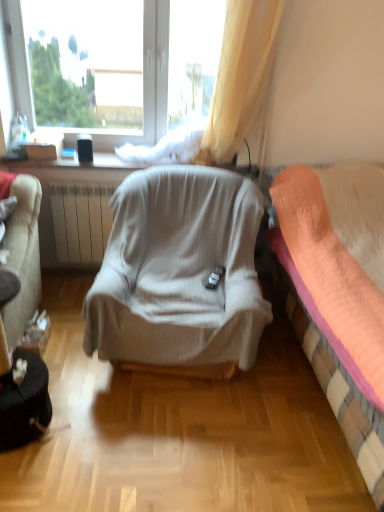
Identify the location of free space in front of light gray fabric chair at center. (170, 444).